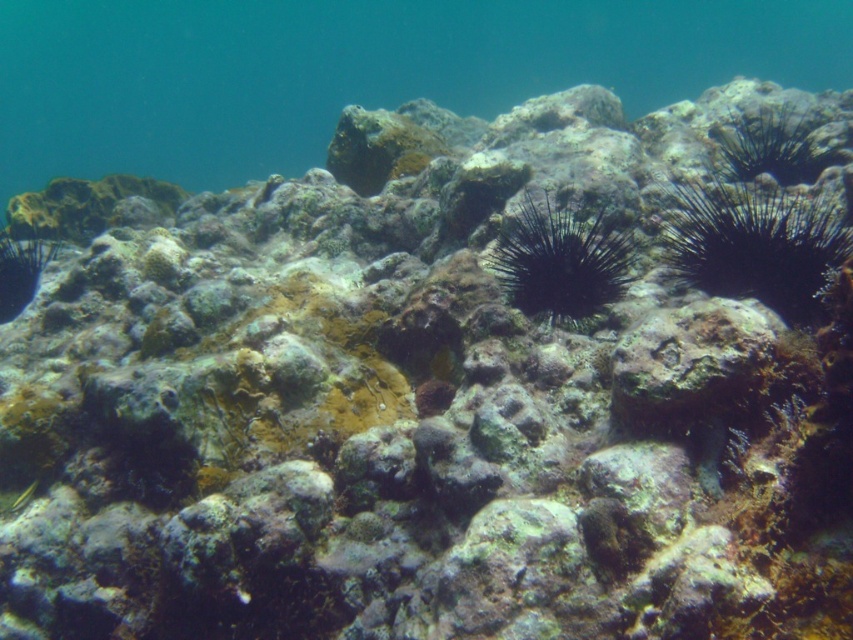
You are a marine biologist studying underwater life. You notice a black spiny sea urchin at right in the image. Can you confirm if this sea urchin is located at the coordinates point (753, 243)?

Yes, the point (753, 243) indicates the location of the black spiny sea urchin at right.

Looking at this image, you are a marine biologist diving underwater and want to observe the black spiny sea urchin at right closely. Given that your diving gear allows you to move freely within 2 meters, can you safely approach it without exceeding your gear limit?

The distance between you and the black spiny sea urchin at right is 1.72 meters, which is within your diving gear limit of 2 meters. Therefore, you can safely approach it without exceeding the limit.